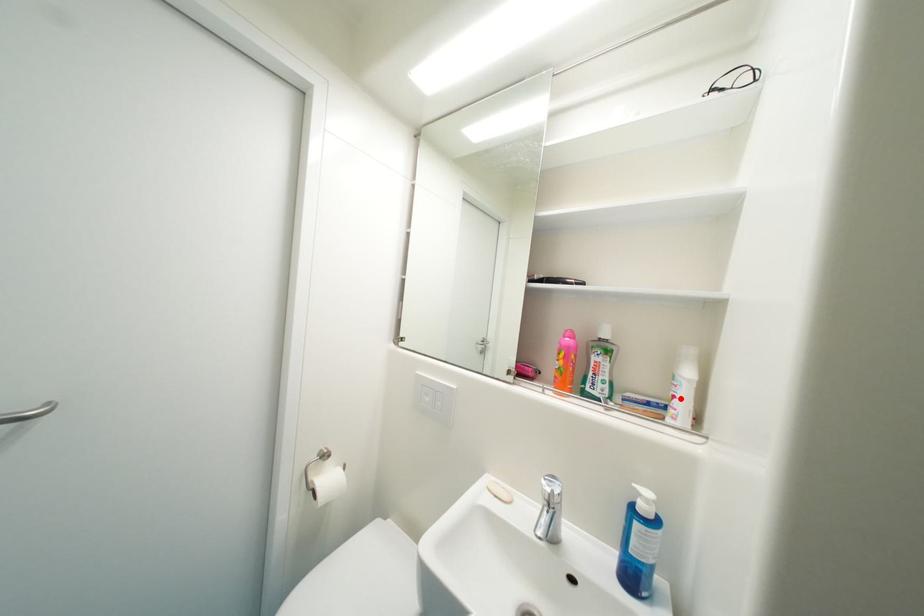
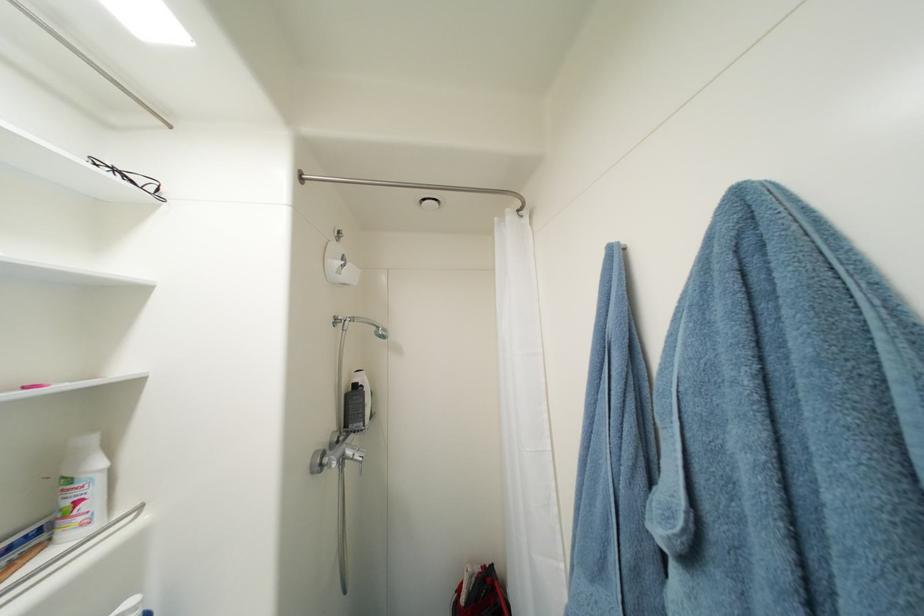
The point at the highlighted location is marked in the first image. Where is the corresponding point in the second image?

(84, 504)